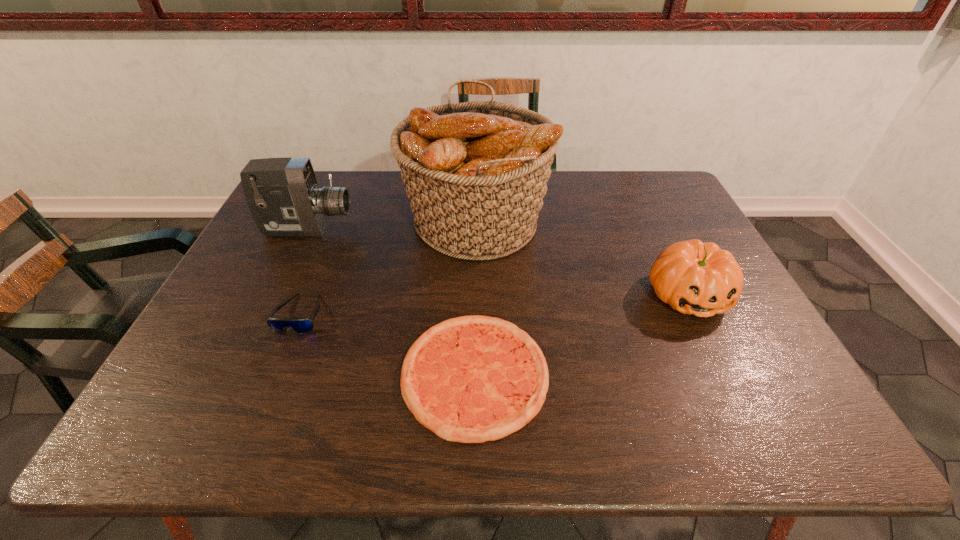
This screenshot has height=540, width=960. In order to click on vacant point located between the tallest object and the pumpkin in this screenshot , I will do `click(582, 258)`.

Identify the location of unoccupied area between the second shortest object and the basket. pyautogui.click(x=388, y=268).

Find the location of a particular element. This screenshot has height=540, width=960. blank region between the sunglasses and the third shortest object is located at coordinates (494, 305).

The height and width of the screenshot is (540, 960). In order to click on empty space that is in between the camcorder and the fourth tallest object in this screenshot , I will do `click(304, 272)`.

You are a GUI agent. You are given a task and a screenshot of the screen. Output one action in this format:
    pyautogui.click(x=<x>, y=<y>)
    Task: Click on the free space between the shortest object and the third shortest object
    The width and height of the screenshot is (960, 540).
    Given the screenshot: What is the action you would take?
    pyautogui.click(x=582, y=334)

The width and height of the screenshot is (960, 540). What are the coordinates of `free space between the fourth tallest object and the pizza` in the screenshot? It's located at (388, 344).

This screenshot has width=960, height=540. What are the coordinates of `free space between the camcorder and the tallest object` in the screenshot? It's located at (392, 225).

Locate an element on the screen. Image resolution: width=960 pixels, height=540 pixels. vacant space in between the fourth shortest object and the second shortest object is located at coordinates coord(304,272).

The width and height of the screenshot is (960, 540). Identify the location of free spot between the pumpkin and the second tallest object. (498, 262).

You are a GUI agent. You are given a task and a screenshot of the screen. Output one action in this format:
    pyautogui.click(x=<x>, y=<y>)
    Task: Click on the vacant space that's between the shortest object and the pumpkin
    
    Given the screenshot: What is the action you would take?
    pyautogui.click(x=582, y=334)